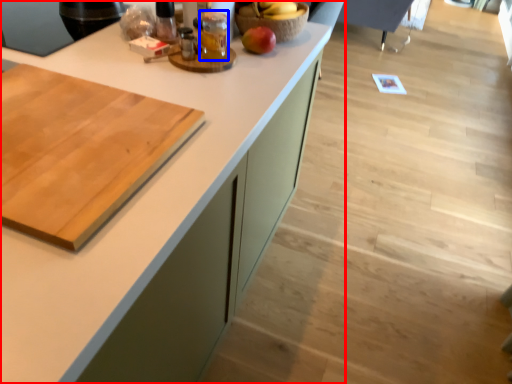
Question: Which object is closer to the camera taking this photo, countertop (highlighted by a red box) or beverage (highlighted by a blue box)?

Choices:
 (A) countertop
 (B) beverage

Answer: (A)